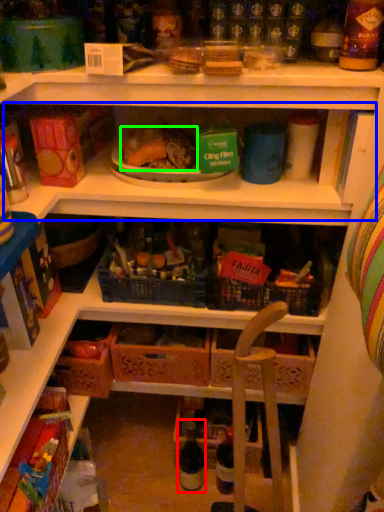
Question: Based on their relative distances, which object is nearer to bottle (highlighted by a red box)? Choose from shelf (highlighted by a blue box) and food (highlighted by a green box).

Choices:
 (A) shelf
 (B) food

Answer: (A)